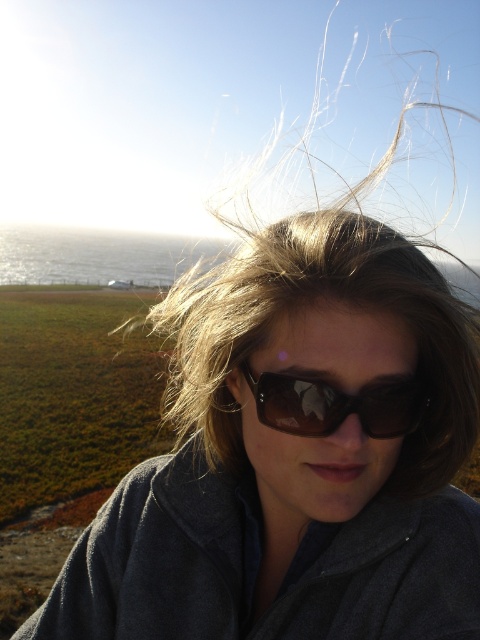
Question: Does blonde hair at center appear on the left side of brown reflective sunglasses at center?

Choices:
 (A) yes
 (B) no

Answer: (A)

Question: Is the position of blonde hair at center more distant than that of brown reflective sunglasses at center?

Choices:
 (A) no
 (B) yes

Answer: (B)

Question: Can you confirm if blonde hair at center is thinner than brown reflective sunglasses at center?

Choices:
 (A) yes
 (B) no

Answer: (A)

Question: Among these points, which one is farthest from the camera?

Choices:
 (A) (338, 403)
 (B) (432, 477)

Answer: (B)